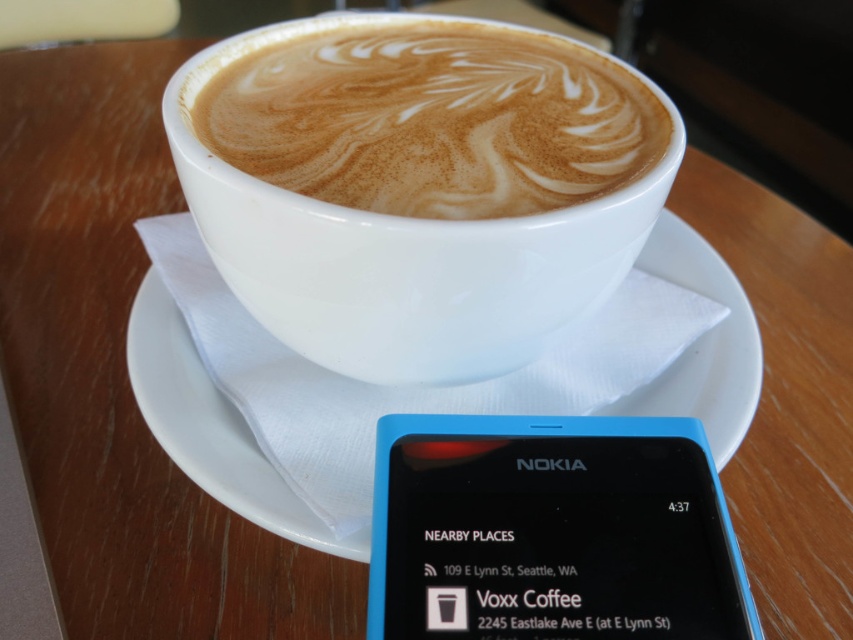
You are a barista who needs to deliver a cup to a customer. The customer is holding a blue plastic nokia phone at lower center. Where should you place the white matte cup at center so it doesn t fall?

The blue plastic nokia phone at lower center is positioned under the white matte cup at center, so placing the white matte cup at center directly above the phone would prevent it from falling.